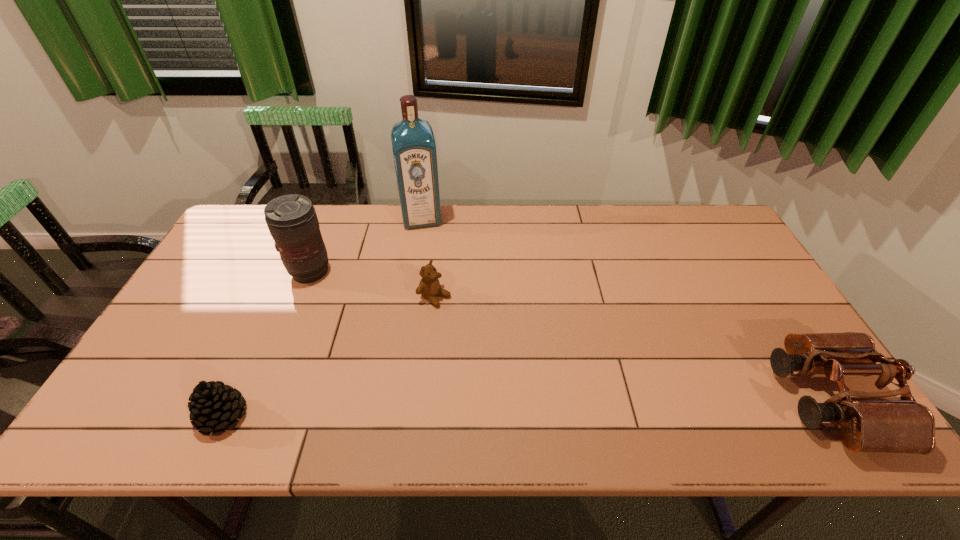
This screenshot has height=540, width=960. In order to click on pinecone at the near edge in this screenshot , I will do `click(214, 406)`.

The image size is (960, 540). In order to click on binoculars located at the near edge in this screenshot , I will do `click(870, 421)`.

The height and width of the screenshot is (540, 960). I want to click on object positioned at the right edge, so 870,421.

I want to click on object positioned at the near right corner, so click(870, 421).

This screenshot has width=960, height=540. Identify the location of free region at the far edge. (544, 233).

You are a GUI agent. You are given a task and a screenshot of the screen. Output one action in this format:
    pyautogui.click(x=<x>, y=<y>)
    Task: Click on the free space at the near edge
    This screenshot has width=960, height=540.
    Given the screenshot: What is the action you would take?
    pyautogui.click(x=266, y=375)

At what (x,y) coordinates should I click in order to perform the action: click on vacant space at the left edge of the desktop. Please return your answer as a coordinate pair (x, y). Looking at the image, I should click on (235, 268).

In order to click on free spot at the right edge of the desktop in this screenshot , I will do `click(700, 268)`.

Identify the location of vacant position at the far left corner of the desktop. The image size is (960, 540). (251, 246).

What are the coordinates of `unoccupied position between the teddy bear and the third tallest object` in the screenshot? It's located at (632, 348).